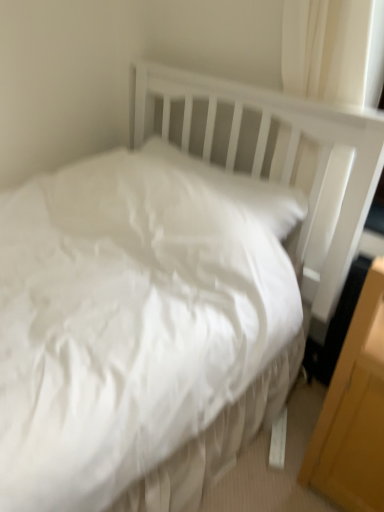
Question: Is the position of white fabric curtain at upper right more distant than that of yellow wood/file cabinet at lower right?

Choices:
 (A) yes
 (B) no

Answer: (A)

Question: Would you say white fabric curtain at upper right contains yellow wood/file cabinet at lower right?

Choices:
 (A) yes
 (B) no

Answer: (B)

Question: Can you confirm if white fabric curtain at upper right is taller than yellow wood/file cabinet at lower right?

Choices:
 (A) yes
 (B) no

Answer: (B)

Question: From a real-world perspective, is white fabric curtain at upper right positioned under yellow wood/file cabinet at lower right based on gravity?

Choices:
 (A) yes
 (B) no

Answer: (B)

Question: Is there a large distance between white fabric curtain at upper right and yellow wood/file cabinet at lower right?

Choices:
 (A) no
 (B) yes

Answer: (A)

Question: Is white soft pillow at upper center to the left or to the right of yellow wood/file cabinet at lower right in the image?

Choices:
 (A) left
 (B) right

Answer: (A)

Question: From the image's perspective, is white soft pillow at upper center above or below yellow wood/file cabinet at lower right?

Choices:
 (A) above
 (B) below

Answer: (A)

Question: Considering the positions of point pos(177,151) and point pos(382,273), is point pos(177,151) closer or farther from the camera than point pos(382,273)?

Choices:
 (A) closer
 (B) farther

Answer: (B)

Question: From a real-world perspective, is white soft pillow at upper center positioned above or below yellow wood/file cabinet at lower right?

Choices:
 (A) above
 (B) below

Answer: (A)

Question: Is white fabric curtain at upper right to the left or to the right of yellow wood/file cabinet at lower right in the image?

Choices:
 (A) right
 (B) left

Answer: (B)

Question: Is white fabric curtain at upper right bigger or smaller than yellow wood/file cabinet at lower right?

Choices:
 (A) big
 (B) small

Answer: (B)

Question: From a real-world perspective, is white fabric curtain at upper right positioned above or below yellow wood/file cabinet at lower right?

Choices:
 (A) below
 (B) above

Answer: (B)

Question: From their relative heights in the image, would you say white fabric curtain at upper right is taller or shorter than yellow wood/file cabinet at lower right?

Choices:
 (A) short
 (B) tall

Answer: (A)

Question: Considering the positions of point (269, 193) and point (359, 102), is point (269, 193) closer or farther from the camera than point (359, 102)?

Choices:
 (A) closer
 (B) farther

Answer: (B)

Question: Looking at the image, does white soft pillow at upper center seem bigger or smaller compared to white fabric curtain at upper right?

Choices:
 (A) big
 (B) small

Answer: (B)